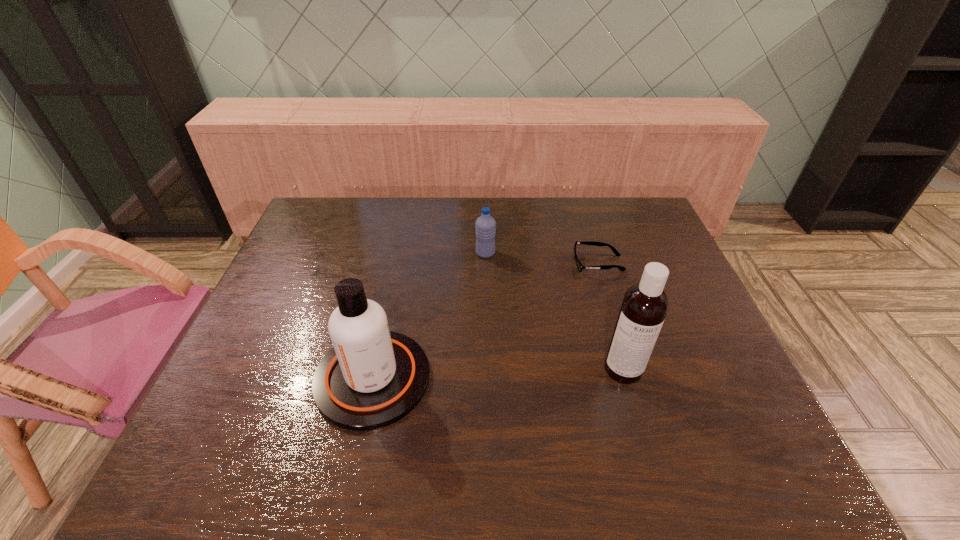
Image resolution: width=960 pixels, height=540 pixels. Find the location of `dishwasher detergent`. dishwasher detergent is located at coordinates (645, 305).

This screenshot has height=540, width=960. What are the coordinates of `cleansing agent` in the screenshot? It's located at (372, 377).

Where is `water bottle`? The image size is (960, 540). water bottle is located at coordinates (485, 227).

Where is `the second shortest object`? the second shortest object is located at coordinates (485, 227).

At what (x,y) coordinates should I click in order to perform the action: click on the shortest object. Please return your answer as a coordinate pair (x, y). The width and height of the screenshot is (960, 540). Looking at the image, I should click on (580, 267).

Identify the location of blank space located on the label side of the dishwasher detergent. (646, 447).

Where is `free point located 0.350m on the back of the cleansing agent`? free point located 0.350m on the back of the cleansing agent is located at coordinates (400, 250).

Image resolution: width=960 pixels, height=540 pixels. Find the location of `vacant space positioned on the right of the water bottle`. vacant space positioned on the right of the water bottle is located at coordinates (556, 253).

What are the coordinates of `vacant region located 0.260m on the front-facing side of the shortest object` in the screenshot? It's located at (489, 264).

Image resolution: width=960 pixels, height=540 pixels. Identify the location of vacant position located on the front-facing side of the shortest object. (475, 264).